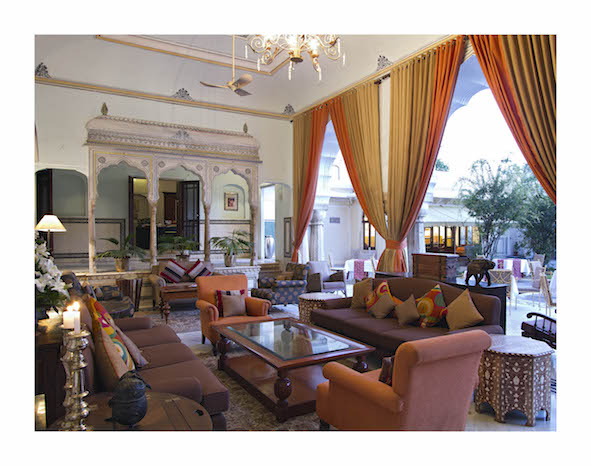
The image size is (591, 466). What are the coordinates of `drapes` in the screenshot? It's located at (298, 157), (360, 131), (410, 128), (531, 117).